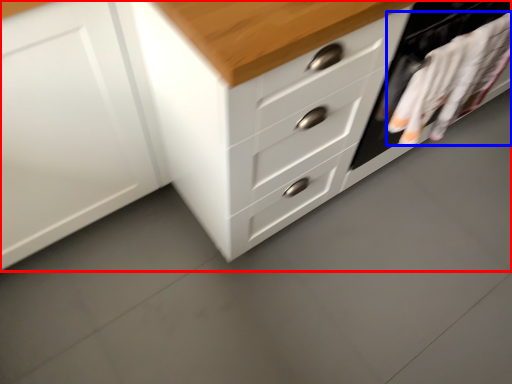
Question: Which object is closer to the camera taking this photo, chest of drawers (highlighted by a red box) or laundry (highlighted by a blue box)?

Choices:
 (A) chest of drawers
 (B) laundry

Answer: (A)